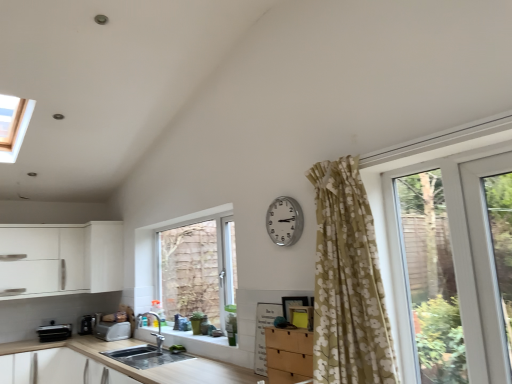
Question: Is metallic silver toaster at lower left, the second appliance viewed from the left, to the right of smooth concrete sink at lower center from the viewer's perspective?

Choices:
 (A) yes
 (B) no

Answer: (B)

Question: From the image's perspective, would you say metallic silver toaster at lower left, the second appliance viewed from the left, is shown under smooth concrete sink at lower center?

Choices:
 (A) no
 (B) yes

Answer: (B)

Question: Does metallic silver toaster at lower left, acting as the 2th appliance starting from the right, have a larger size compared to smooth concrete sink at lower center?

Choices:
 (A) no
 (B) yes

Answer: (B)

Question: Can you confirm if metallic silver toaster at lower left, acting as the 2th appliance starting from the right, is thinner than smooth concrete sink at lower center?

Choices:
 (A) yes
 (B) no

Answer: (B)

Question: Does metallic silver toaster at lower left, acting as the 2th appliance starting from the right, appear on the left side of smooth concrete sink at lower center?

Choices:
 (A) no
 (B) yes

Answer: (B)

Question: From the image's perspective, is black plastic toaster at lower left, which appears as the third appliance when viewed from the right, above or below white plastic toaster at lower left, the first appliance in the right-to-left sequence?

Choices:
 (A) above
 (B) below

Answer: (B)

Question: From their relative heights in the image, would you say black plastic toaster at lower left, which appears as the third appliance when viewed from the right, is taller or shorter than white plastic toaster at lower left, acting as the 3th appliance starting from the left?

Choices:
 (A) short
 (B) tall

Answer: (B)

Question: In terms of size, does black plastic toaster at lower left, which appears as the third appliance when viewed from the right, appear bigger or smaller than white plastic toaster at lower left, the first appliance in the right-to-left sequence?

Choices:
 (A) big
 (B) small

Answer: (A)

Question: In terms of width, does black plastic toaster at lower left, positioned as the 1th appliance in left-to-right order, look wider or thinner when compared to white plastic toaster at lower left, acting as the 3th appliance starting from the left?

Choices:
 (A) wide
 (B) thin

Answer: (A)

Question: Considering the positions of black plastic toaster at lower left, which appears as the third appliance when viewed from the right, and wooden at lower left in the image, is black plastic toaster at lower left, which appears as the third appliance when viewed from the right, wider or thinner than wooden at lower left?

Choices:
 (A) wide
 (B) thin

Answer: (B)

Question: From their relative heights in the image, would you say black plastic toaster at lower left, which appears as the third appliance when viewed from the right, is taller or shorter than wooden at lower left?

Choices:
 (A) tall
 (B) short

Answer: (B)

Question: Looking at the image, does black plastic toaster at lower left, positioned as the 1th appliance in left-to-right order, seem bigger or smaller compared to wooden at lower left?

Choices:
 (A) big
 (B) small

Answer: (B)

Question: Does point (68, 336) appear closer or farther from the camera than point (58, 342)?

Choices:
 (A) closer
 (B) farther

Answer: (B)

Question: Is white matte cabinet at left in front of or behind metallic silver toaster at lower left, acting as the 2th appliance starting from the right, in the image?

Choices:
 (A) front
 (B) behind

Answer: (A)

Question: Is white matte cabinet at left to the left or to the right of metallic silver toaster at lower left, the second appliance viewed from the left, in the image?

Choices:
 (A) left
 (B) right

Answer: (B)